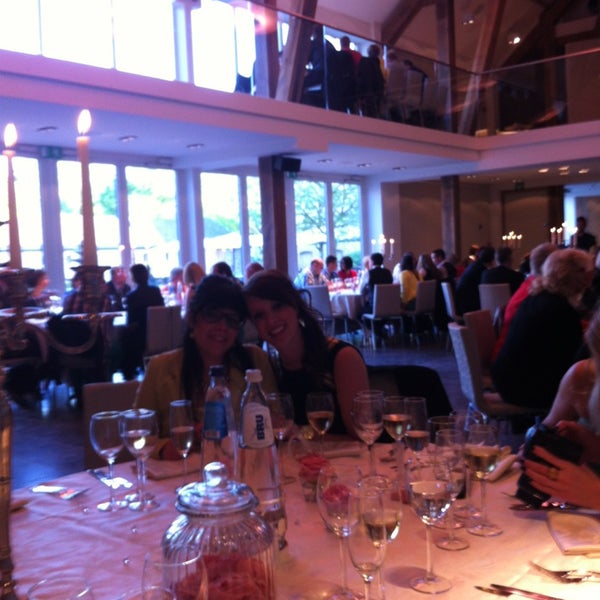
The image size is (600, 600). I want to click on white tablecloth, so click(x=72, y=561).